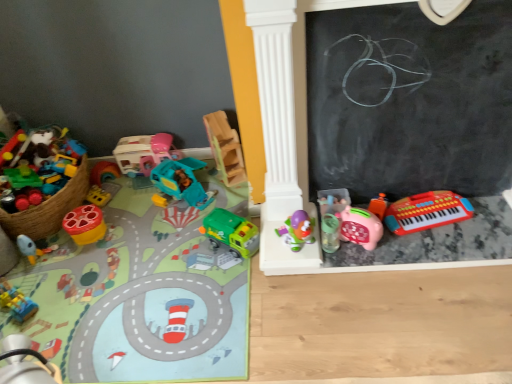
Identify the location of free space in front of shiny plastic toy at left, arranged as the 3th toy when viewed from the left. The height and width of the screenshot is (384, 512). (85, 258).